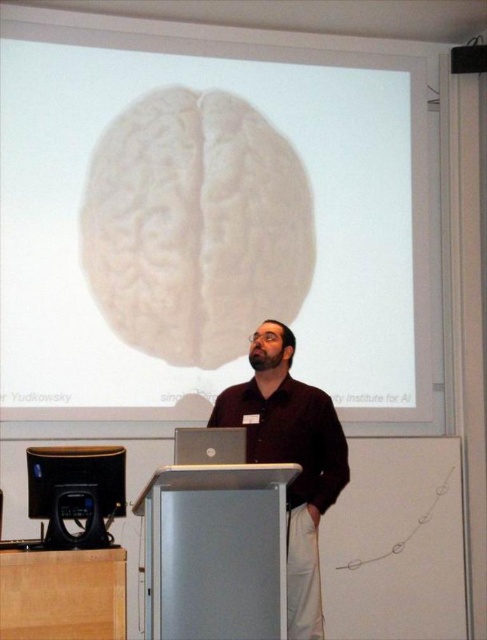
Does dark brown shirt at center appear over black glossy monitor at lower left?

Yes.

Is point (312, 442) farther from viewer compared to point (74, 540)?

Yes, it is.

The image size is (487, 640). I want to click on dark brown shirt at center, so click(x=291, y=458).

Measure the distance between white matte projection screen at upper center and dark brown shirt at center.

white matte projection screen at upper center and dark brown shirt at center are 1.14 meters apart.

Can you confirm if white matte projection screen at upper center is positioned to the right of dark brown shirt at center?

Incorrect, white matte projection screen at upper center is not on the right side of dark brown shirt at center.

Locate an element on the screen. white matte projection screen at upper center is located at coordinates (207, 221).

Between dark brown shirt at center and silver metallic laptop at center, which one is positioned higher?

silver metallic laptop at center

Is point (348, 476) positioned after point (191, 454)?

Yes, it is behind point (191, 454).

Where is `dark brown shirt at center`? This screenshot has width=487, height=640. dark brown shirt at center is located at coordinates (291, 458).